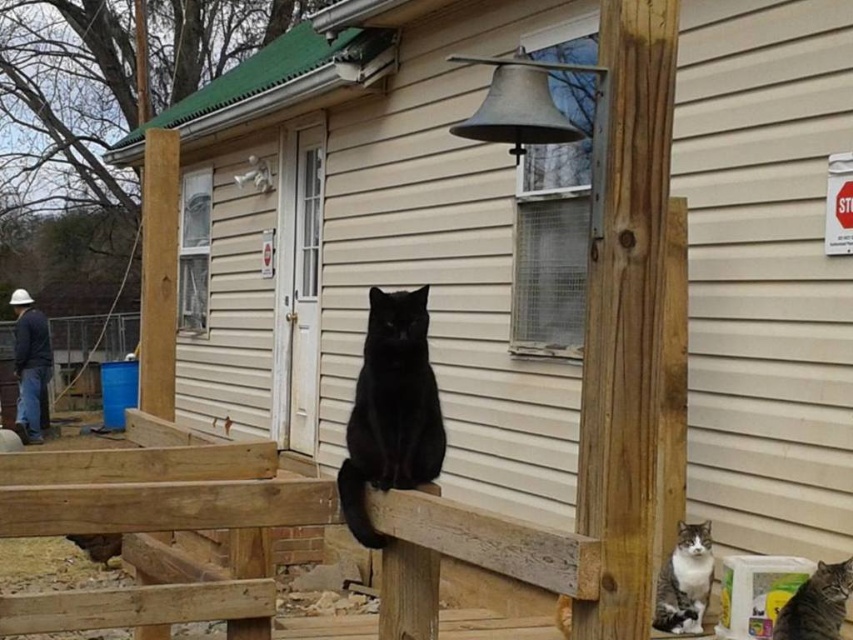
Question: Which point is closer to the camera?

Choices:
 (A) (355, 451)
 (B) (838, 636)

Answer: (A)

Question: Can you confirm if black matte/solid cat at center is positioned to the left of gray tabby cat at lower right?

Choices:
 (A) no
 (B) yes

Answer: (B)

Question: Does black matte/solid cat at center appear on the right side of tabby fur cat at lower right?

Choices:
 (A) yes
 (B) no

Answer: (B)

Question: Which of the following is the farthest from the observer?

Choices:
 (A) tabby fur cat at lower right
 (B) gray tabby cat at lower right
 (C) black matte/solid cat at center

Answer: (B)

Question: Which point is closer to the camera taking this photo?

Choices:
 (A) (784, 636)
 (B) (660, 573)
 (C) (374, 435)

Answer: (C)

Question: Is gray tabby cat at lower right positioned behind tabby fur cat at lower right?

Choices:
 (A) yes
 (B) no

Answer: (A)